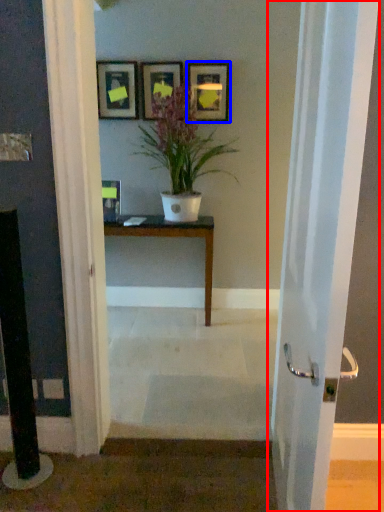
Question: Which object appears farthest to the camera in this image, door (highlighted by a red box) or picture frame (highlighted by a blue box)?

Choices:
 (A) door
 (B) picture frame

Answer: (B)